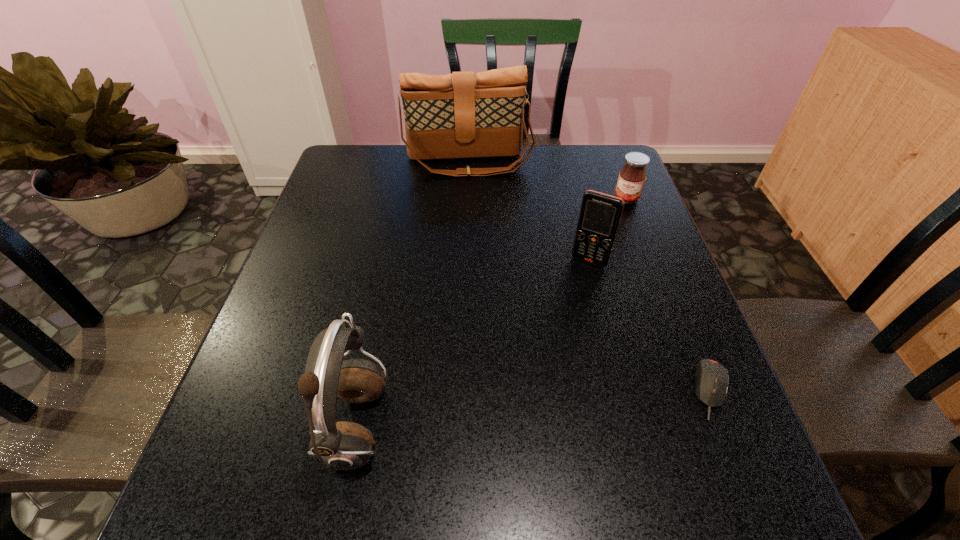
Find the location of a particular element. The image size is (960, 540). vacant space located on the label side of the fourth nearest object is located at coordinates (603, 257).

The width and height of the screenshot is (960, 540). In order to click on free region located 0.230m on the label side of the fourth nearest object in this screenshot , I will do (x=603, y=257).

Image resolution: width=960 pixels, height=540 pixels. I want to click on free spot located on the front-facing side of the farthest object, so click(476, 200).

Identify the location of vacant area situated 0.260m on the front-facing side of the farthest object. The height and width of the screenshot is (540, 960). click(480, 234).

At what (x,y) coordinates should I click in order to perform the action: click on free space located on the front-facing side of the farthest object. Please return your answer as a coordinate pair (x, y). The height and width of the screenshot is (540, 960). Looking at the image, I should click on coord(484,264).

Locate an element on the screen. free region located on the screen of the third object from right to left is located at coordinates 516,400.

This screenshot has height=540, width=960. Identify the location of vacant space located 0.320m on the screen of the third object from right to left. (531, 372).

Where is `free region located 0.360m on the screen of the third object from right to left`? free region located 0.360m on the screen of the third object from right to left is located at coordinates (522, 388).

I want to click on object that is at the far edge, so click(460, 115).

Locate an element on the screen. The width and height of the screenshot is (960, 540). earphone located at the near edge is located at coordinates (343, 445).